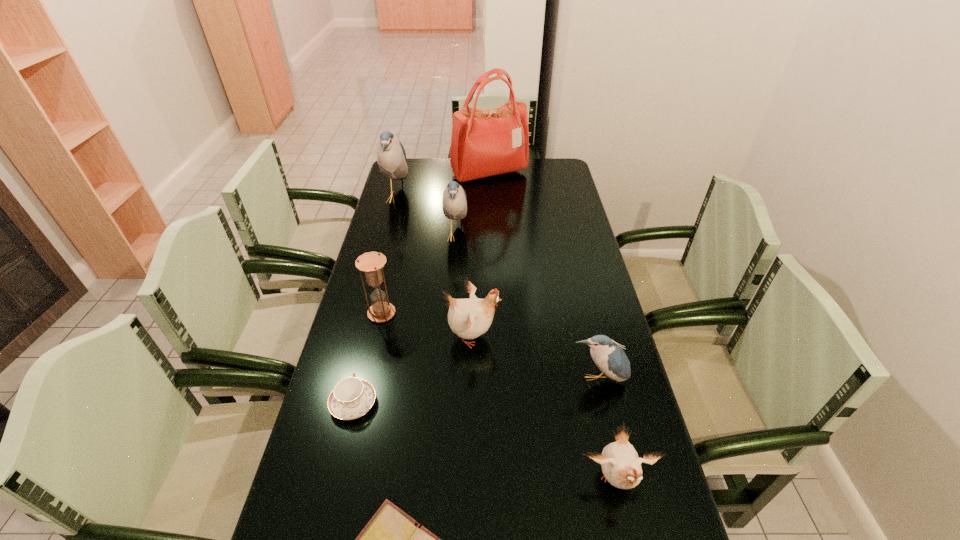
This screenshot has width=960, height=540. In order to click on red handbag in this screenshot , I will do `click(485, 142)`.

The width and height of the screenshot is (960, 540). Identify the location of handbag. (485, 142).

Where is `the farthest blue bird`? the farthest blue bird is located at coordinates (391, 157).

Where is `the farthest bird`? Image resolution: width=960 pixels, height=540 pixels. the farthest bird is located at coordinates (391, 157).

I want to click on the second blue bird from right to left, so click(x=454, y=203).

The image size is (960, 540). In order to click on the second smallest blue bird in this screenshot , I will do `click(454, 203)`.

Locate an element on the screen. The height and width of the screenshot is (540, 960). brown hourglass is located at coordinates (371, 263).

In order to click on the bigger white bird in this screenshot , I will do `click(468, 318)`.

What are the coordinates of `the third farthest bird` in the screenshot? It's located at (468, 318).

What are the coordinates of `the second nearest bird` in the screenshot? It's located at (609, 357).